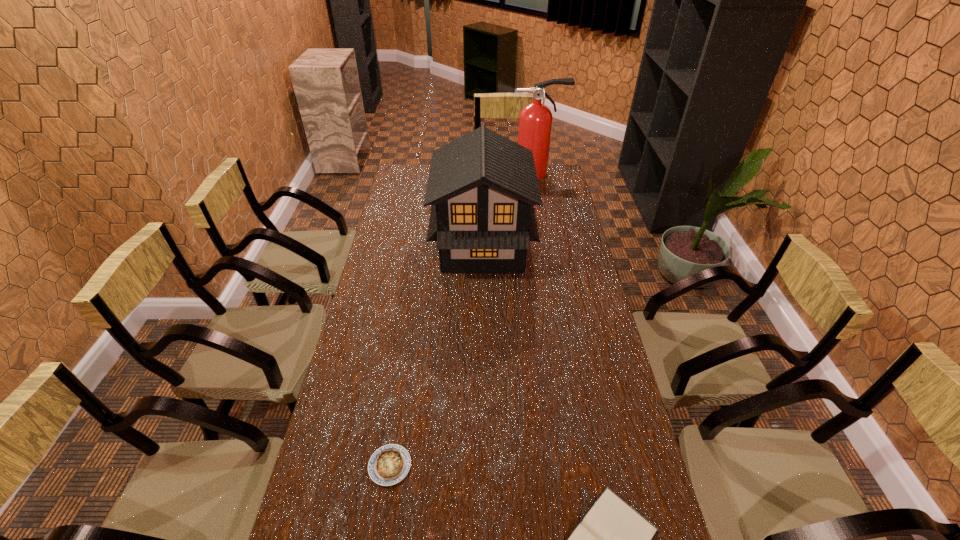
This screenshot has width=960, height=540. In order to click on object that is at the right edge in this screenshot , I will do `click(535, 120)`.

Locate an element on the screen. Image resolution: width=960 pixels, height=540 pixels. object present at the far right corner is located at coordinates (535, 120).

The image size is (960, 540). What are the coordinates of `vacant space at the left edge of the desktop` in the screenshot? It's located at (374, 395).

Identify the location of free spot at the right edge of the desktop. The width and height of the screenshot is (960, 540). (574, 345).

Identify the location of blank space at the far right corner of the desktop. (552, 179).

This screenshot has width=960, height=540. Find the location of `the second closest object relative to the farthest object`. the second closest object relative to the farthest object is located at coordinates (389, 464).

Identify the location of object that stands as the second closest to the third nearest object. This screenshot has height=540, width=960. (389, 464).